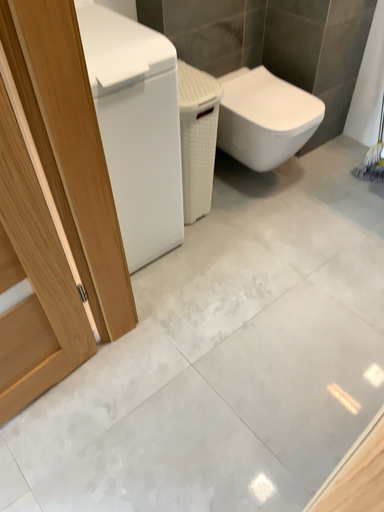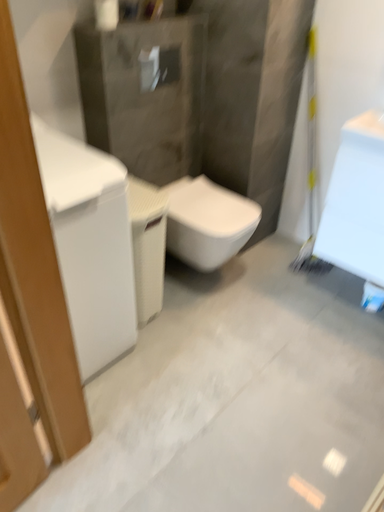
Question: How did the camera likely rotate when shooting the video?

Choices:
 (A) rotated right
 (B) rotated left

Answer: (A)